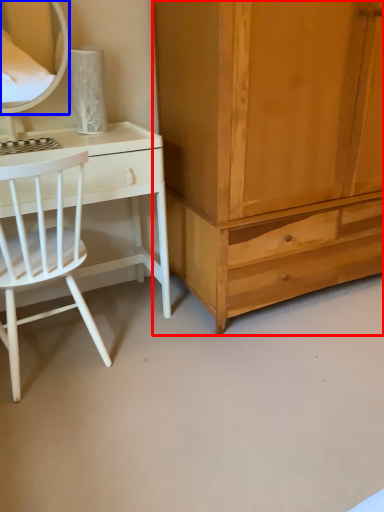
Question: Which point is further to the camera, cabinetry (highlighted by a red box) or mirror (highlighted by a blue box)?

Choices:
 (A) cabinetry
 (B) mirror

Answer: (B)